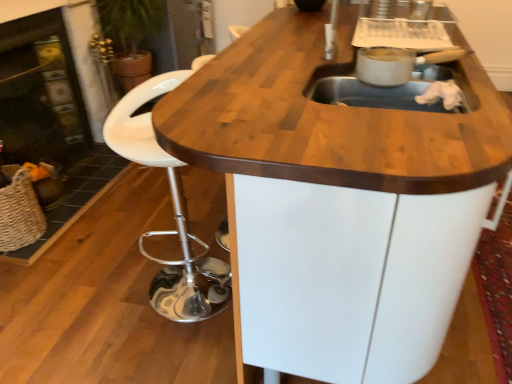
The width and height of the screenshot is (512, 384). What are the coordinates of `empty space that is to the right of woven straw basket at lower left` in the screenshot? It's located at (58, 223).